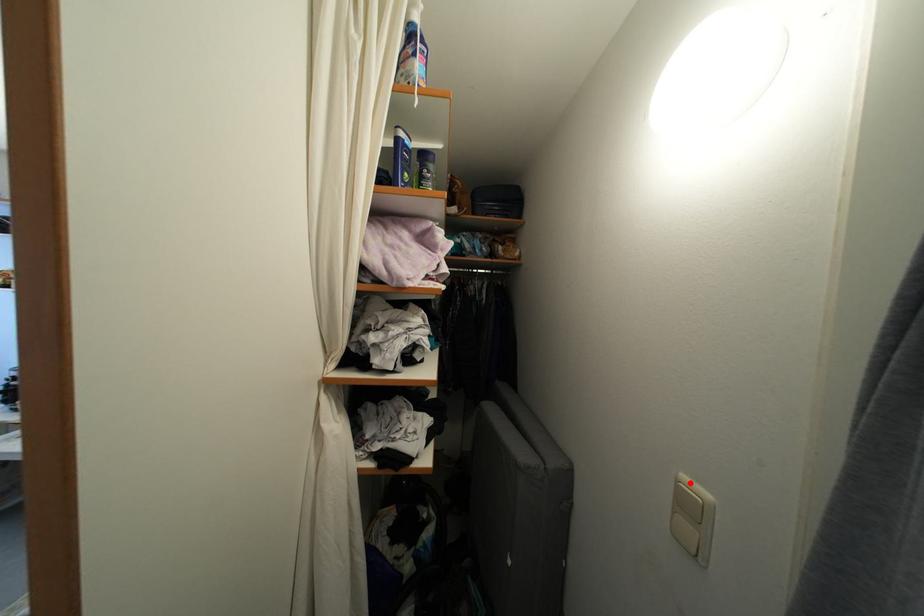
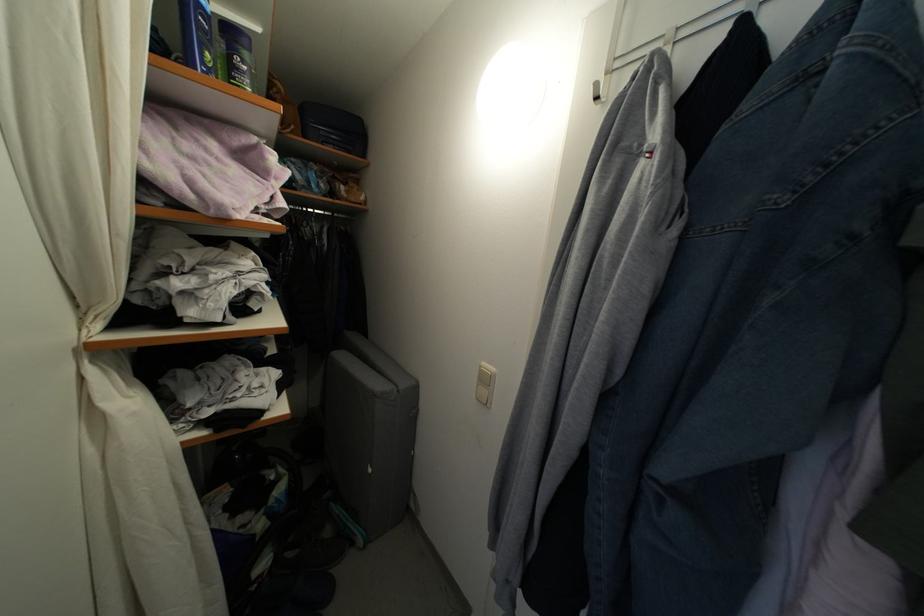
Where in the second image is the point corresponding to the highlighted location from the first image?

(489, 370)